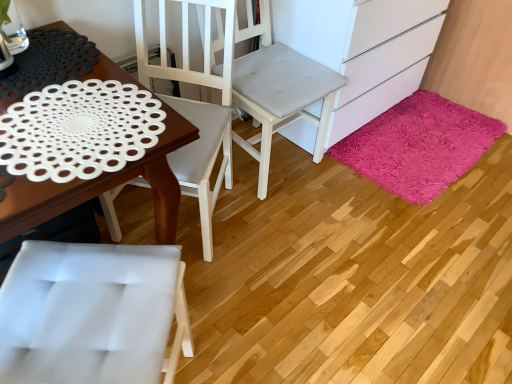
Question: Is shaggy pink rug at lower right wider or thinner than white matte cabinet at lower right?

Choices:
 (A) wide
 (B) thin

Answer: (B)

Question: Visually, is shaggy pink rug at lower right positioned to the left or to the right of white matte cabinet at lower right?

Choices:
 (A) left
 (B) right

Answer: (B)

Question: Based on their relative distances, which object is nearer to the white matte cabinet at lower right?

Choices:
 (A) shaggy pink rug at lower right
 (B) white matte doily at left
 (C) white matte chair at center, placed as the 2th chair when sorted from right to left
 (D) white fabric chair at center, the second chair when ordered from left to right

Answer: (D)

Question: Which object is the farthest from the white matte doily at left?

Choices:
 (A) white matte chair at center, acting as the 1th chair starting from the left
 (B) white matte cabinet at lower right
 (C) shaggy pink rug at lower right
 (D) white fabric chair at center, the second chair when ordered from left to right

Answer: (C)